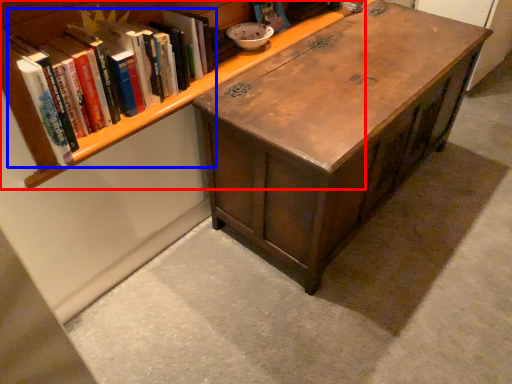
Question: Which object appears farthest to the camera in this image, bookcase (highlighted by a red box) or book (highlighted by a blue box)?

Choices:
 (A) bookcase
 (B) book

Answer: (B)